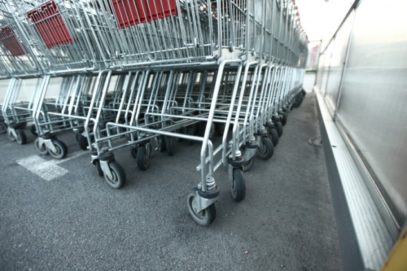
Where is `1 type of material used for flooring`? Image resolution: width=407 pixels, height=271 pixels. 1 type of material used for flooring is located at coordinates (274, 235).